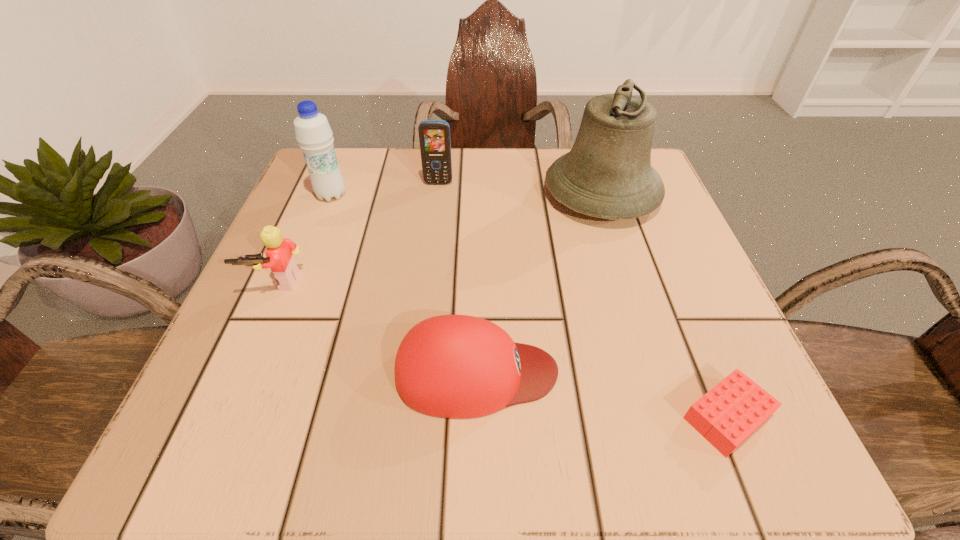
The width and height of the screenshot is (960, 540). I want to click on vacant space located 0.260m on the screen of the fourth shortest object, so click(x=428, y=276).

Find the location of a particular element. This screenshot has width=960, height=540. vacant space located 0.210m in front of the taller Lego with the accessory visible is located at coordinates (215, 424).

This screenshot has width=960, height=540. In order to click on vacant space located 0.180m on the front-facing side of the second shortest object in this screenshot , I will do `click(688, 372)`.

The height and width of the screenshot is (540, 960). In order to click on free location located 0.200m on the back of the shortest object in this screenshot , I will do `click(668, 275)`.

In order to click on bell present at the far edge in this screenshot , I will do `click(607, 174)`.

You are a GUI agent. You are given a task and a screenshot of the screen. Output one action in this format:
    pyautogui.click(x=<x>, y=<y>)
    Task: Click on the water bottle positioned at the far edge
    The width and height of the screenshot is (960, 540).
    Given the screenshot: What is the action you would take?
    pyautogui.click(x=313, y=133)

Find the location of a particular element. This screenshot has width=960, height=540. cellular telephone that is at the far edge is located at coordinates (434, 135).

Identify the location of baseball cap present at the near edge. (452, 366).

Find the location of a particular element. Lego that is positioned at the near edge is located at coordinates (730, 412).

Locate an element on the screen. water bottle that is at the left edge is located at coordinates (313, 133).